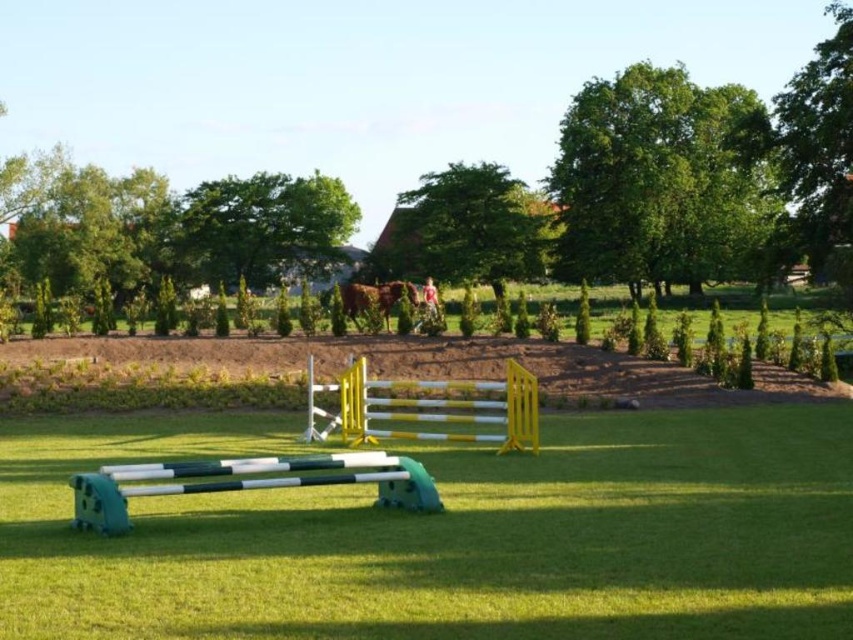
Question: Is the position of yellow plastic hurdle at center less distant than that of brown glossy horse at center?

Choices:
 (A) yes
 (B) no

Answer: (A)

Question: Which point appears farthest from the camera in this image?

Choices:
 (A) (393, 285)
 (B) (149, 566)
 (C) (524, 451)

Answer: (A)

Question: Can you confirm if yellow plastic hurdle at center is smaller than green rubber hurdle at center?

Choices:
 (A) yes
 (B) no

Answer: (B)

Question: Among these points, which one is farthest from the camera?

Choices:
 (A) (132, 486)
 (B) (605, 628)

Answer: (A)

Question: Is yellow plastic hurdle at center wider than brown glossy horse at center?

Choices:
 (A) yes
 (B) no

Answer: (B)

Question: Which point is farther from the camera taking this photo?

Choices:
 (A) (351, 301)
 (B) (381, 451)

Answer: (A)